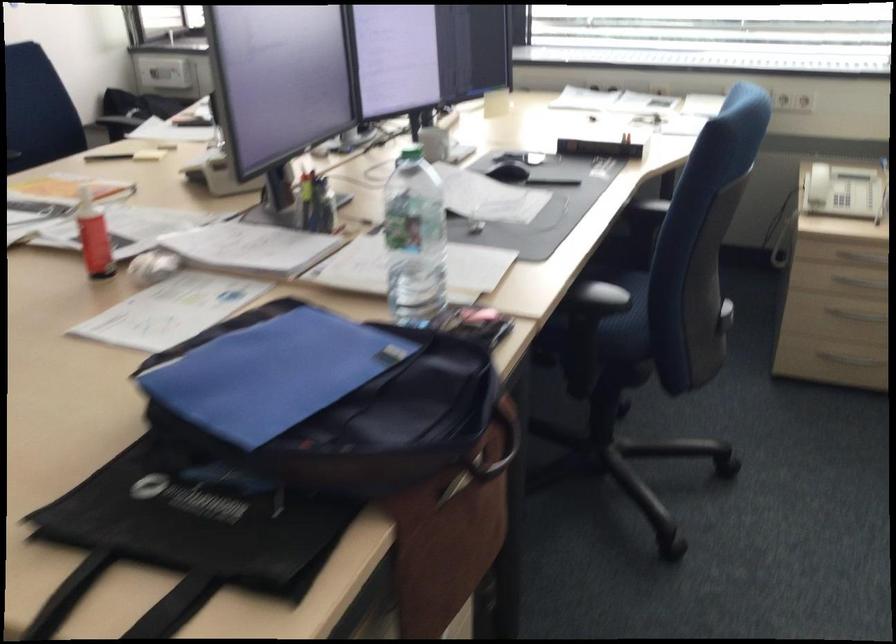
The image size is (896, 644). What do you see at coordinates (410, 152) in the screenshot?
I see `a green bottle cap` at bounding box center [410, 152].